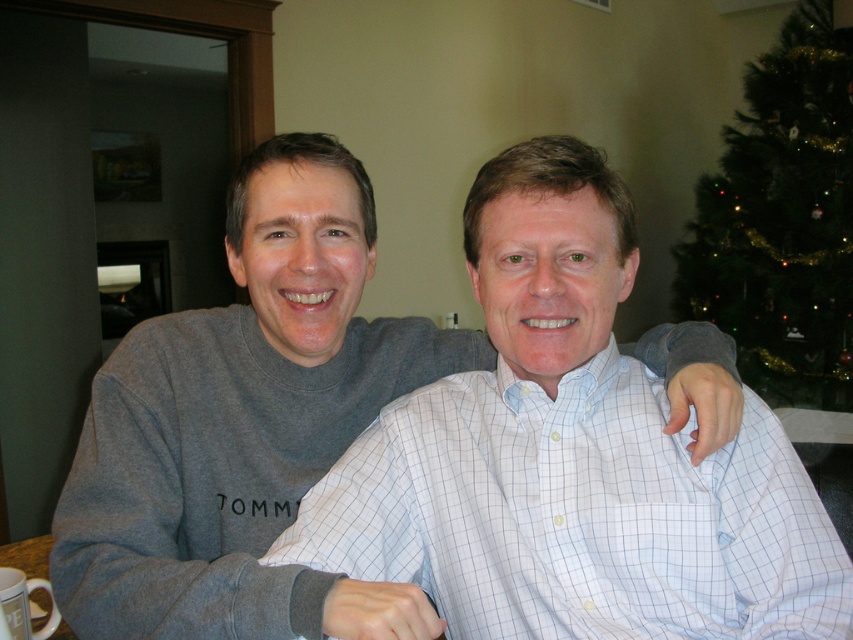
Question: Observing the image, what is the correct spatial positioning of gray cotton shirt at center in reference to green matte christmas tree at upper right?

Choices:
 (A) below
 (B) above

Answer: (A)

Question: Is gray cotton shirt at center thinner than green matte christmas tree at upper right?

Choices:
 (A) yes
 (B) no

Answer: (B)

Question: Is gray cotton shirt at center to the right of green matte christmas tree at upper right from the viewer's perspective?

Choices:
 (A) no
 (B) yes

Answer: (A)